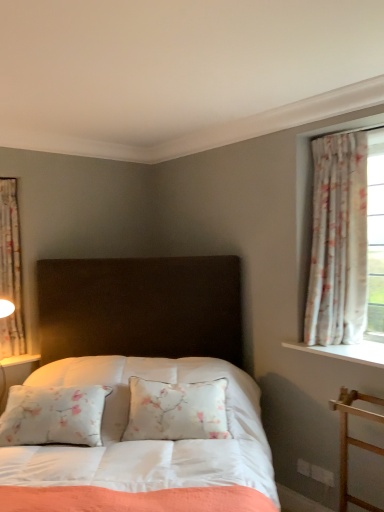
What are the coordinates of `vacant region above floral fabric curtain at left, acting as the second curtain starting from the front (from a real-world perspective)` in the screenshot? It's located at (11, 177).